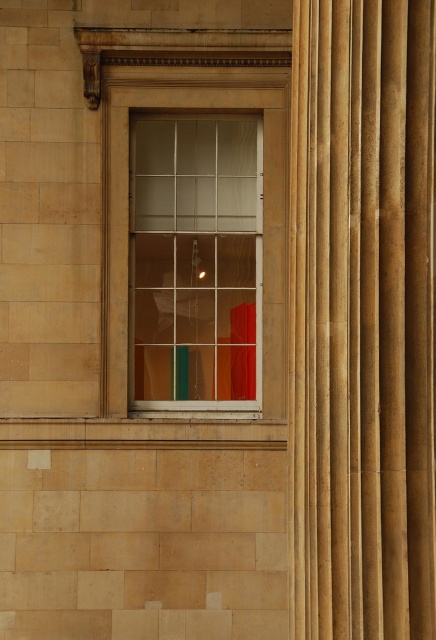
You are an interior designer assessing the classical building. You notice the matte fabric curtain at center and the clear glass window at center. Which object is positioned lower in the scene?

The matte fabric curtain at center is located below the clear glass window at center, so it is positioned lower in the scene.

You are standing in front of the classical building and notice both the matte fabric curtain at center and the clear glass window at center. Which object is positioned to the right of the other?

The matte fabric curtain at center is to the right of the clear glass window at center.

You are an interior designer who wants to hang a decorative tapestry that is 1.2 meters wide on the wall. You have two options in the image, the matte fabric curtain at center and the clear glass window at center. Which object can accommodate the tapestry without overlapping its edges?

The clear glass window at center has a greater width than the matte fabric curtain at center, so the tapestry would fit better on the clear glass window at center since it is wider.